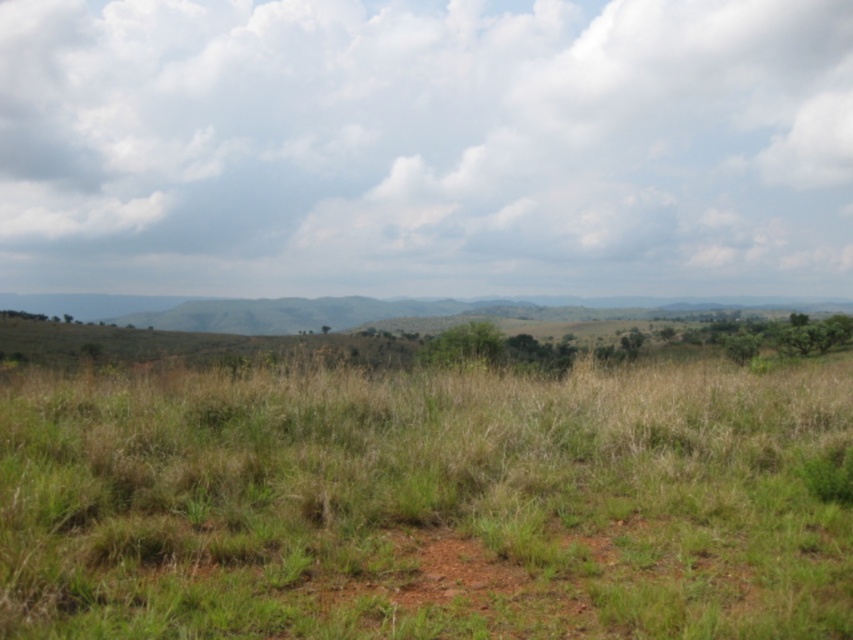
Question: Does white fluffy cloud at upper center come behind green grassy at center?

Choices:
 (A) yes
 (B) no

Answer: (A)

Question: Which of the following is the farthest from the observer?

Choices:
 (A) white fluffy cloud at upper center
 (B) green grassy at center

Answer: (A)

Question: Does white fluffy cloud at upper center have a greater width compared to green grassy at center?

Choices:
 (A) yes
 (B) no

Answer: (A)

Question: Can you confirm if white fluffy cloud at upper center is wider than green grassy at center?

Choices:
 (A) yes
 (B) no

Answer: (A)